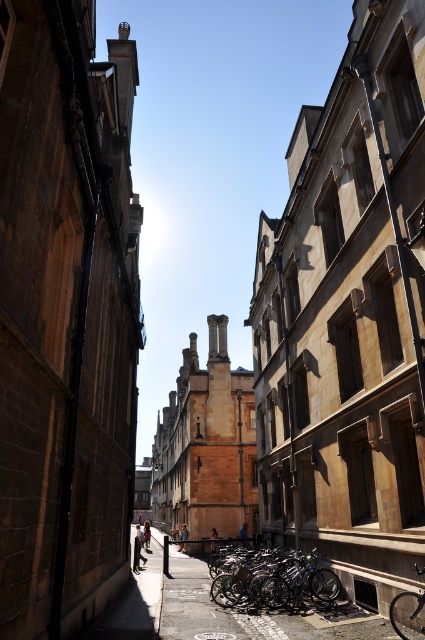
Question: Does shiny metallic bicycles at center have a lesser width compared to metallic bicycle at lower center?

Choices:
 (A) no
 (B) yes

Answer: (B)

Question: Is brown stone building at left closer to camera compared to shiny metallic bicycle at center?

Choices:
 (A) no
 (B) yes

Answer: (B)

Question: Among these points, which one is nearest to the camera?

Choices:
 (A) (118, 400)
 (B) (144, 586)

Answer: (A)

Question: Estimate the real-world distances between objects in this image. Which object is farther from the smooth concrete pavement at center?

Choices:
 (A) brown stone building at left
 (B) shiny metallic bicycles at center
 (C) metallic bicycle at lower center
 (D) shiny metallic bicycle at center

Answer: (A)

Question: Can you confirm if brown stone building at left is bigger than shiny metallic bicycle at center?

Choices:
 (A) no
 (B) yes

Answer: (B)

Question: Which object appears closest to the camera in this image?

Choices:
 (A) smooth concrete pavement at center
 (B) shiny metallic bicycles at center
 (C) shiny metallic bicycle at center
 (D) brown stone building at left

Answer: (D)